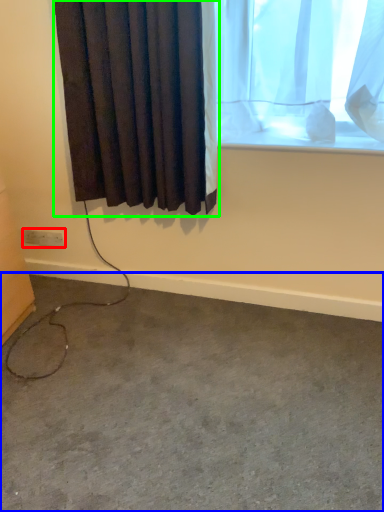
Question: Considering the real-world distances, which object is closest to electric outlet (highlighted by a red box)? concrete (highlighted by a blue box) or curtain (highlighted by a green box).

Choices:
 (A) concrete
 (B) curtain

Answer: (B)